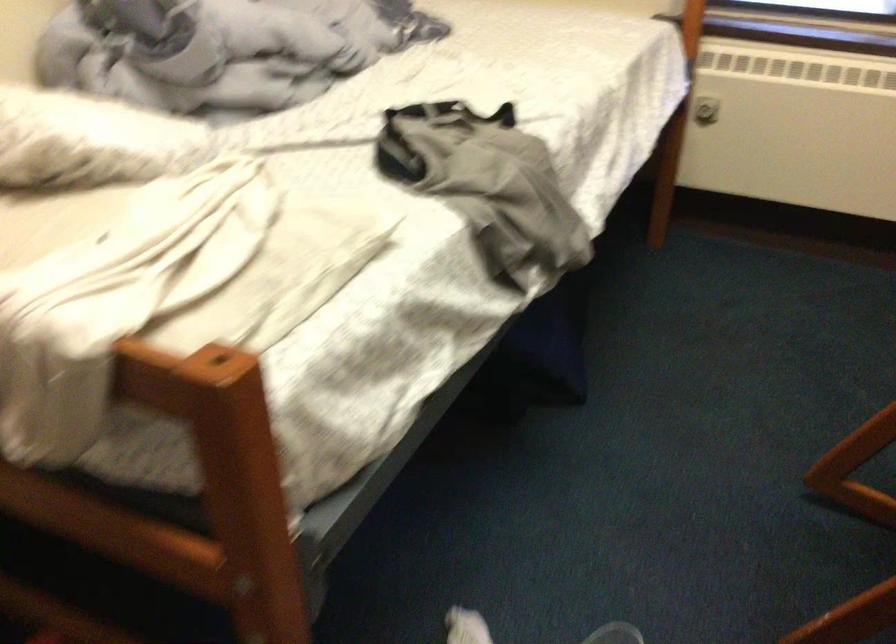
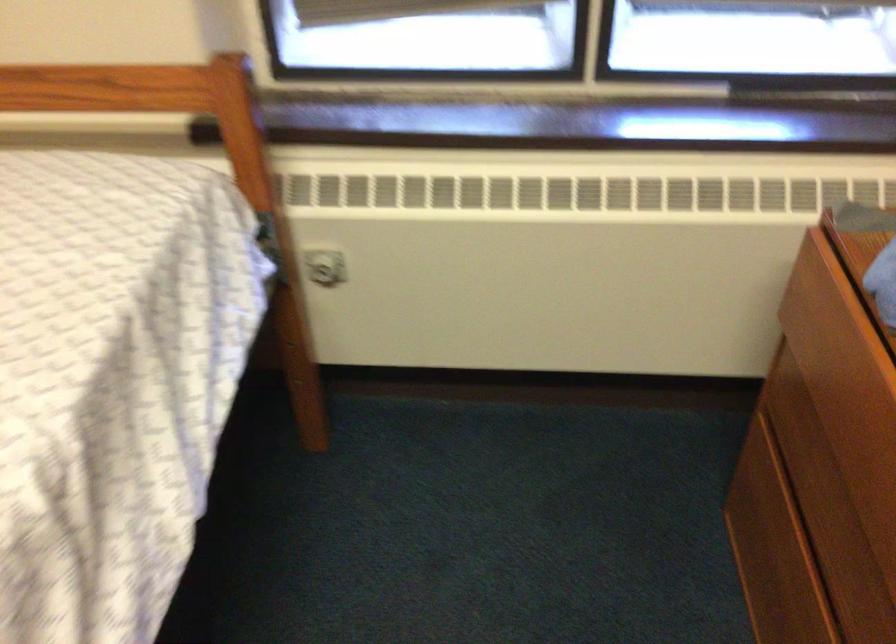
Find the pixel in the second image that matches point (710, 106) in the first image.

(323, 267)